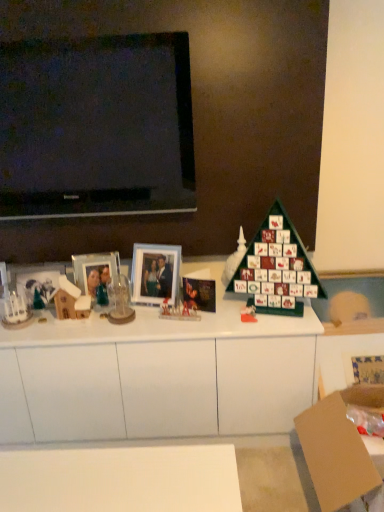
Locate an element on the screen. glossy paper christmas card at center is located at coordinates tap(199, 294).

Where is `green matte advent calendar at center, which is the first toy from right to left`? The width and height of the screenshot is (384, 512). green matte advent calendar at center, which is the first toy from right to left is located at coordinates (248, 314).

What do you see at coordinates (277, 267) in the screenshot? The height and width of the screenshot is (512, 384). I see `green matte advent calendar at right` at bounding box center [277, 267].

The height and width of the screenshot is (512, 384). What are the coordinates of `white matte cabinet at center` in the screenshot? It's located at pyautogui.click(x=157, y=375).

In order to face wooden house at left, which ranks as the fourth toy in right-to-left order, should I rotate leftwards or rightwards?

To align with it, rotate left about 16.145°.

Find the location of a particular element. This screenshot has width=384, height=512. matte plastic picture frame at center, the second picture frame from the left is located at coordinates (155, 273).

How much space does translucent glass figurine at center, placed as the second toy when sorted from left to right, occupy vertically?

It is 3.51 inches.

Where is `glossy paper christmas card at center`? Image resolution: width=384 pixels, height=512 pixels. glossy paper christmas card at center is located at coordinates (199, 294).

From a real-world perspective, between translucent glass figurine at center, which appears as the third toy when viewed from the right, and green matte advent calendar at right, who is vertically lower?

translucent glass figurine at center, which appears as the third toy when viewed from the right, is physically lower.

Could you measure the distance between translucent glass figurine at center, which appears as the third toy when viewed from the right, and green matte advent calendar at right?

A distance of 14.44 inches exists between translucent glass figurine at center, which appears as the third toy when viewed from the right, and green matte advent calendar at right.

Looking at the image, does translucent glass figurine at center, which appears as the third toy when viewed from the right, seem bigger or smaller compared to green matte advent calendar at right?

In the image, translucent glass figurine at center, which appears as the third toy when viewed from the right, appears to be smaller than green matte advent calendar at right.

Does translucent glass figurine at center, which appears as the third toy when viewed from the right, have a greater width compared to green matte advent calendar at right?

No, translucent glass figurine at center, which appears as the third toy when viewed from the right, is not wider than green matte advent calendar at right.

Measure the distance from glossy paper christmas card at center to white matte christmas tree at center, acting as the third toy starting from the left.

8.61 inches.

Is glossy paper christmas card at center in front of or behind white matte christmas tree at center, the second toy positioned from the right, in the image?

In the image, glossy paper christmas card at center appears in front of white matte christmas tree at center, the second toy positioned from the right.

What's the angular difference between glossy paper christmas card at center and white matte christmas tree at center, acting as the third toy starting from the left,'s facing directions?

17.4 degrees separate the facing orientations of glossy paper christmas card at center and white matte christmas tree at center, acting as the third toy starting from the left.

Which of these two, glossy paper christmas card at center or white matte christmas tree at center, acting as the third toy starting from the left, is smaller?

glossy paper christmas card at center is smaller.

Which toy is the 2nd one when counting from the front of the white matte christmas tree at center, acting as the third toy starting from the left? Please provide its 2D coordinates.

[(178, 312)]

Which object is wider, translucent glass figurine at center, placed as the second toy when sorted from left to right, or white matte christmas tree at center, the second toy positioned from the right?

white matte christmas tree at center, the second toy positioned from the right, is wider.

From a real-world perspective, is translucent glass figurine at center, placed as the second toy when sorted from left to right, located beneath white matte christmas tree at center, the second toy positioned from the right?

Correct, in the physical world, translucent glass figurine at center, placed as the second toy when sorted from left to right, is lower than white matte christmas tree at center, the second toy positioned from the right.

Is translucent glass figurine at center, placed as the second toy when sorted from left to right, in contact with white matte christmas tree at center, the second toy positioned from the right?

No, translucent glass figurine at center, placed as the second toy when sorted from left to right, is not touching white matte christmas tree at center, the second toy positioned from the right.

Which is more to the right, matte plastic picture frame at center, the first picture frame positioned from the right, or white matte christmas tree at center, the second toy positioned from the right?

white matte christmas tree at center, the second toy positioned from the right.

Could you tell me if matte plastic picture frame at center, the first picture frame positioned from the right, is turned towards white matte christmas tree at center, the second toy positioned from the right?

No, matte plastic picture frame at center, the first picture frame positioned from the right, is not oriented towards white matte christmas tree at center, the second toy positioned from the right.

Is matte plastic picture frame at center, the second picture frame from the left, further to camera compared to white matte christmas tree at center, the second toy positioned from the right?

No, matte plastic picture frame at center, the second picture frame from the left, is closer to the camera.

Consider the image. In terms of width, does matte plastic picture frame at center, the first picture frame positioned from the right, look wider or thinner when compared to white matte christmas tree at center, acting as the third toy starting from the left?

matte plastic picture frame at center, the first picture frame positioned from the right, is thinner than white matte christmas tree at center, acting as the third toy starting from the left.

From the image's perspective, is white matte christmas tree at center, acting as the third toy starting from the left, located above matte plastic picture frame at center, the second picture frame from the left?

Indeed, from the image's perspective, white matte christmas tree at center, acting as the third toy starting from the left, is shown above matte plastic picture frame at center, the second picture frame from the left.

Is white matte christmas tree at center, acting as the third toy starting from the left, to the right of matte plastic picture frame at center, the first picture frame positioned from the right, from the viewer's perspective?

Yes.

Between white matte christmas tree at center, acting as the third toy starting from the left, and matte plastic picture frame at center, the second picture frame from the left, which one has less height?

white matte christmas tree at center, acting as the third toy starting from the left.

Is white matte christmas tree at center, acting as the third toy starting from the left, not close to matte plastic picture frame at center, the first picture frame positioned from the right?

white matte christmas tree at center, acting as the third toy starting from the left, is near matte plastic picture frame at center, the first picture frame positioned from the right, not far away.

Could you measure the distance between green matte advent calendar at center, marked as the fourth toy in a left-to-right arrangement, and matte glass picture frame at left, the second picture frame in the right-to-left sequence?

A distance of 26.51 inches exists between green matte advent calendar at center, marked as the fourth toy in a left-to-right arrangement, and matte glass picture frame at left, the second picture frame in the right-to-left sequence.

Consider the image. Which object is further away from the camera, green matte advent calendar at center, marked as the fourth toy in a left-to-right arrangement, or matte glass picture frame at left, the second picture frame in the right-to-left sequence?

matte glass picture frame at left, the second picture frame in the right-to-left sequence, is behind.

From a real-world perspective, is green matte advent calendar at center, which is the first toy from right to left, positioned under matte glass picture frame at left, the second picture frame in the right-to-left sequence, based on gravity?

Answer: Yes, from a real-world perspective, green matte advent calendar at center, which is the first toy from right to left, is below matte glass picture frame at left, the second picture frame in the right-to-left sequence.

From the image's perspective, does green matte advent calendar at center, marked as the fourth toy in a left-to-right arrangement, appear lower than matte glass picture frame at left, the second picture frame in the right-to-left sequence?

Yes, from the image's perspective, green matte advent calendar at center, marked as the fourth toy in a left-to-right arrangement, is below matte glass picture frame at left, the second picture frame in the right-to-left sequence.

Which of these two, translucent glass figurine at center, which appears as the third toy when viewed from the right, or brown cardboard box at lower right, is bigger?

brown cardboard box at lower right is bigger.

Based on the photo, from the image's perspective, which one is positioned higher, translucent glass figurine at center, placed as the second toy when sorted from left to right, or brown cardboard box at lower right?

translucent glass figurine at center, placed as the second toy when sorted from left to right, from the image's perspective.

Which of these two, translucent glass figurine at center, which appears as the third toy when viewed from the right, or brown cardboard box at lower right, is thinner?

translucent glass figurine at center, which appears as the third toy when viewed from the right, is thinner.

Would you consider translucent glass figurine at center, which appears as the third toy when viewed from the right, to be distant from brown cardboard box at lower right?

No.

Identify the location of toy that is the 3rd one below the green matte advent calendar at right (from a real-world perspective). This screenshot has height=512, width=384. (178, 312).

This screenshot has width=384, height=512. I want to click on christmas card in front of the white matte christmas tree at center, acting as the third toy starting from the left, so click(x=199, y=294).

From the image, which object appears to be farther from white matte cabinet at center, brown cardboard box at lower right or glossy paper christmas card at center?

Based on the image, brown cardboard box at lower right appears to be further to white matte cabinet at center.

Based on their spatial positions, is translucent glass figurine at center, placed as the second toy when sorted from left to right, or green matte advent calendar at center, marked as the fourth toy in a left-to-right arrangement, further from matte plastic picture frame at center, the first picture frame positioned from the right?

The object further to matte plastic picture frame at center, the first picture frame positioned from the right, is green matte advent calendar at center, marked as the fourth toy in a left-to-right arrangement.

Looking at the image, which one is located closer to white matte cabinet at center, matte plastic picture frame at center, the first picture frame positioned from the right, or wooden house at left, which ranks as the fourth toy in right-to-left order?

matte plastic picture frame at center, the first picture frame positioned from the right, lies closer to white matte cabinet at center than the other object.

Based on their spatial positions, is wooden house at left, acting as the first toy starting from the left, or white matte christmas tree at center, acting as the third toy starting from the left, further from matte plastic picture frame at center, the second picture frame from the left?

white matte christmas tree at center, acting as the third toy starting from the left, is further to matte plastic picture frame at center, the second picture frame from the left.

Based on their spatial positions, is wooden house at left, which ranks as the fourth toy in right-to-left order, or matte glass picture frame at left, arranged as the first picture frame when viewed from the left, closer to glossy paper christmas card at center?

The object closer to glossy paper christmas card at center is matte glass picture frame at left, arranged as the first picture frame when viewed from the left.

Based on their spatial positions, is green matte advent calendar at center, marked as the fourth toy in a left-to-right arrangement, or white matte christmas tree at center, acting as the third toy starting from the left, further from wooden house at left, acting as the first toy starting from the left?

green matte advent calendar at center, marked as the fourth toy in a left-to-right arrangement, is further to wooden house at left, acting as the first toy starting from the left.

Looking at the image, which one is located closer to green matte advent calendar at center, which is the first toy from right to left, glossy paper christmas card at center or green matte advent calendar at right?

Based on the image, glossy paper christmas card at center appears to be nearer to green matte advent calendar at center, which is the first toy from right to left.

Which object lies further to the anchor point green matte advent calendar at center, marked as the fourth toy in a left-to-right arrangement, translucent glass figurine at center, which appears as the third toy when viewed from the right, or wooden house at left, which ranks as the fourth toy in right-to-left order?

Based on the image, wooden house at left, which ranks as the fourth toy in right-to-left order, appears to be further to green matte advent calendar at center, marked as the fourth toy in a left-to-right arrangement.

Locate an element on the screen. The image size is (384, 512). christmas card between matte glass picture frame at left, arranged as the first picture frame when viewed from the left, and green matte advent calendar at right from left to right is located at coordinates (199, 294).

Identify the location of christmas card situated between matte plastic picture frame at center, the second picture frame from the left, and white matte christmas tree at center, acting as the third toy starting from the left, from left to right. Image resolution: width=384 pixels, height=512 pixels. (199, 294).

Locate an element on the screen. cabinetry located between wooden house at left, which ranks as the fourth toy in right-to-left order, and white matte christmas tree at center, acting as the third toy starting from the left, in the left-right direction is located at coordinates (157, 375).

You are a GUI agent. You are given a task and a screenshot of the screen. Output one action in this format:
    pyautogui.click(x=<x>, y=<y>)
    Task: Click on the christmas card located between white matte cabinet at center and green matte advent calendar at right in the left-right direction
    
    Given the screenshot: What is the action you would take?
    pyautogui.click(x=199, y=294)